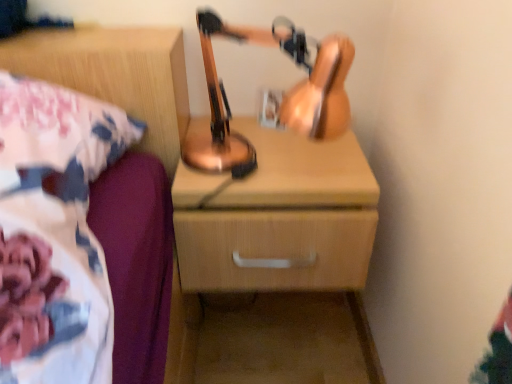
Question: From the image's perspective, is wooden nightstand at upper right on copper metallic table lamp at center?

Choices:
 (A) yes
 (B) no

Answer: (B)

Question: From a real-world perspective, is wooden nightstand at upper right positioned under copper metallic table lamp at center based on gravity?

Choices:
 (A) yes
 (B) no

Answer: (A)

Question: Does wooden nightstand at upper right come behind copper metallic table lamp at center?

Choices:
 (A) yes
 (B) no

Answer: (B)

Question: From a real-world perspective, is wooden nightstand at upper right located higher than copper metallic table lamp at center?

Choices:
 (A) no
 (B) yes

Answer: (A)

Question: Are wooden nightstand at upper right and copper metallic table lamp at center far apart?

Choices:
 (A) no
 (B) yes

Answer: (A)

Question: From a real-world perspective, is wooden chest of drawers at center positioned above or below wooden nightstand at upper right?

Choices:
 (A) below
 (B) above

Answer: (A)

Question: Considering the positions of wooden chest of drawers at center and wooden nightstand at upper right in the image, is wooden chest of drawers at center taller or shorter than wooden nightstand at upper right?

Choices:
 (A) short
 (B) tall

Answer: (B)

Question: Is wooden chest of drawers at center bigger or smaller than wooden nightstand at upper right?

Choices:
 (A) big
 (B) small

Answer: (A)

Question: From the image's perspective, is wooden chest of drawers at center above or below wooden nightstand at upper right?

Choices:
 (A) above
 (B) below

Answer: (B)

Question: From the image's perspective, is wooden nightstand at upper right located above or below wooden chest of drawers at center?

Choices:
 (A) below
 (B) above

Answer: (B)

Question: Is wooden nightstand at upper right taller or shorter than wooden chest of drawers at center?

Choices:
 (A) tall
 (B) short

Answer: (B)

Question: Is wooden nightstand at upper right inside the boundaries of wooden chest of drawers at center, or outside?

Choices:
 (A) outside
 (B) inside

Answer: (A)

Question: From a real-world perspective, is wooden nightstand at upper right above or below wooden chest of drawers at center?

Choices:
 (A) above
 (B) below

Answer: (A)

Question: In terms of width, does wooden chest of drawers at center look wider or thinner when compared to copper metallic table lamp at center?

Choices:
 (A) thin
 (B) wide

Answer: (B)

Question: From a real-world perspective, is wooden chest of drawers at center physically located above or below copper metallic table lamp at center?

Choices:
 (A) above
 (B) below

Answer: (B)